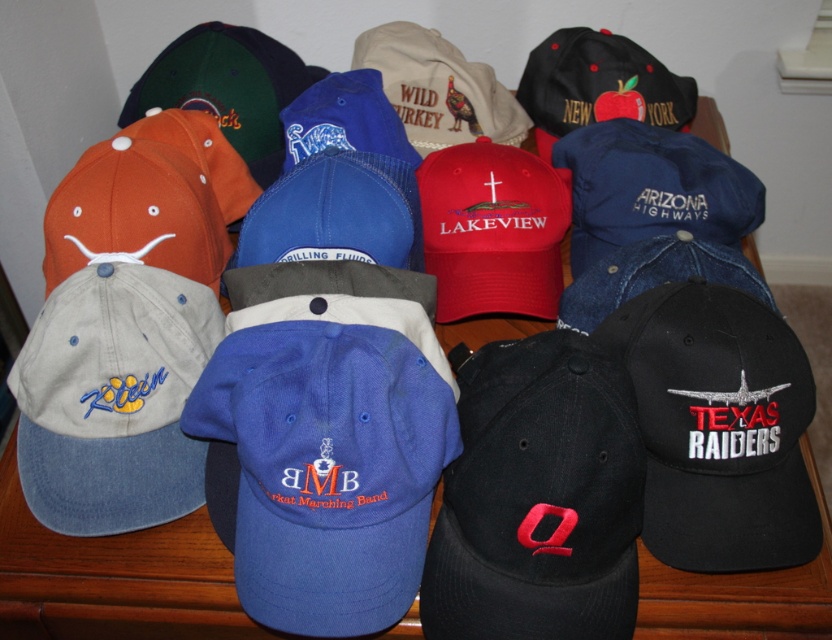
Who is shorter, gray denim baseball cap at left or orange fabric baseball cap at left?

Standing shorter between the two is orange fabric baseball cap at left.

Does gray denim baseball cap at left come behind orange fabric baseball cap at left?

No.

Between point (177, 348) and point (191, 150), which one is positioned behind?

The point (191, 150) is behind.

Find the location of a particular element. gray denim baseball cap at left is located at coordinates pyautogui.click(x=112, y=397).